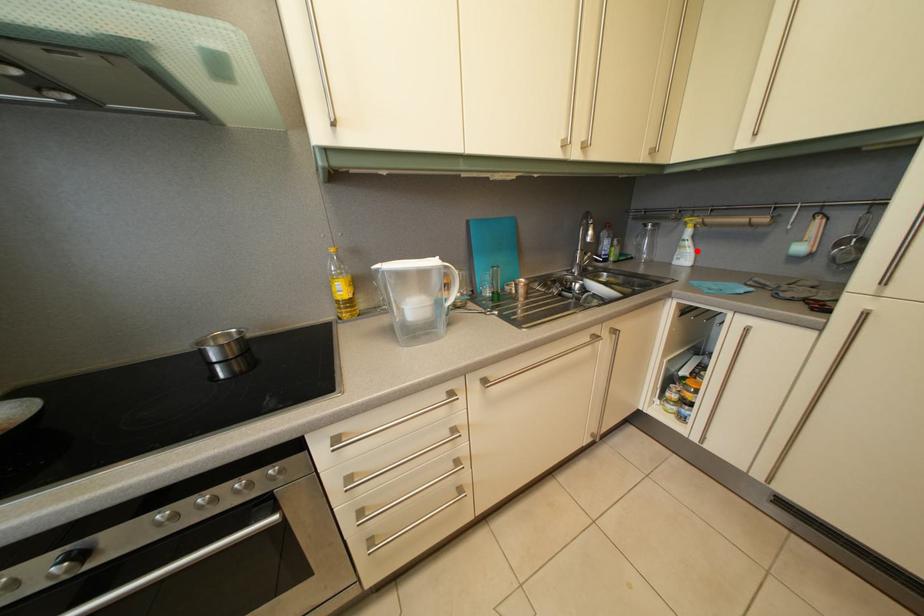
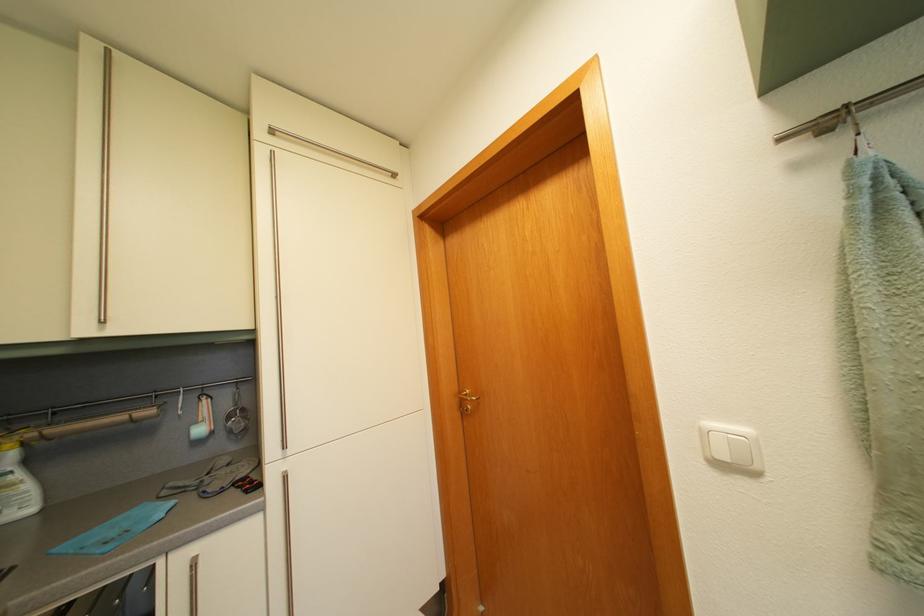
Locate, in the second image, the point that corresponds to the highlighted location in the first image.

(26, 484)